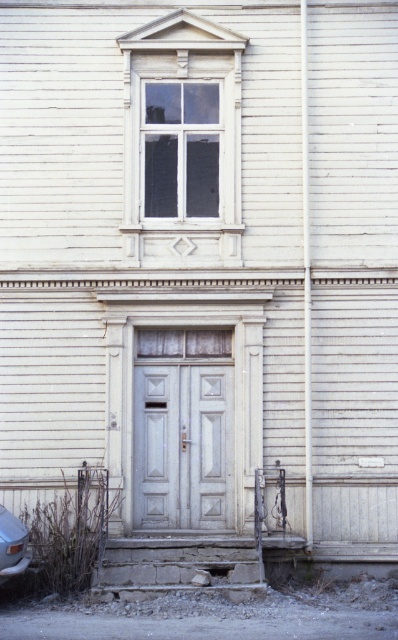
Does white wood window at upper center appear under silver metallic car at lower left?

Incorrect, white wood window at upper center is not positioned below silver metallic car at lower left.

Can you confirm if white wood window at upper center is thinner than silver metallic car at lower left?

In fact, white wood window at upper center might be wider than silver metallic car at lower left.

Is point (152, 156) positioned behind point (1, 509)?

Yes, it is.

The width and height of the screenshot is (398, 640). I want to click on white wood window at upper center, so click(x=181, y=138).

Describe the element at coordinates (181, 138) in the screenshot. I see `white wood window at upper center` at that location.

Does white wood window at upper center appear on the right side of white glass window at upper center?

Indeed, white wood window at upper center is positioned on the right side of white glass window at upper center.

Is point (122, 45) in front of point (169, 179)?

Yes.

This screenshot has width=398, height=640. In order to click on white wood window at upper center in this screenshot , I will do `click(181, 138)`.

Does white wood window at upper center have a larger size compared to white matte door at center?

Yes, white wood window at upper center is bigger than white matte door at center.

Can you confirm if white wood window at upper center is smaller than white matte door at center?

Actually, white wood window at upper center might be larger than white matte door at center.

Does point (200, 253) come farther from viewer compared to point (214, 346)?

No, it is not.

Where is `white wood window at upper center`? This screenshot has width=398, height=640. white wood window at upper center is located at coordinates (181, 138).